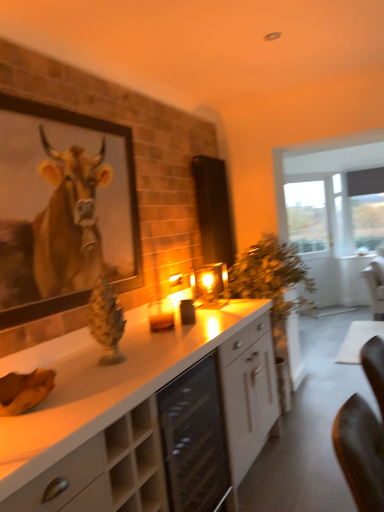
Question: In the image, is beige wood cabinet at lower left, which ranks as the first cabinetry in front-to-back order, positioned in front of or behind matte gray curtain at right?

Choices:
 (A) behind
 (B) front

Answer: (B)

Question: Based on their sizes in the image, would you say beige wood cabinet at lower left, the second cabinetry positioned from the back, is bigger or smaller than matte gray curtain at right?

Choices:
 (A) small
 (B) big

Answer: (B)

Question: Which of these objects is positioned closest to the transparent glass door at right?

Choices:
 (A) beige wood cabinet at lower left, the second cabinetry positioned from the back
 (B) white glossy cabinet at center, acting as the 2th cabinetry starting from the front
 (C) wooden framed cow portrait at upper left
 (D) matte black screen door at center
 (E) matte gray curtain at right

Answer: (E)

Question: Which of these objects is positioned closest to the beige wood cabinet at lower left, the second cabinetry positioned from the back?

Choices:
 (A) wooden framed cow portrait at upper left
 (B) matte black screen door at center
 (C) matte gray curtain at right
 (D) transparent glass door at right
 (E) white glossy cabinet at center, positioned as the first cabinetry in back-to-front order

Answer: (E)